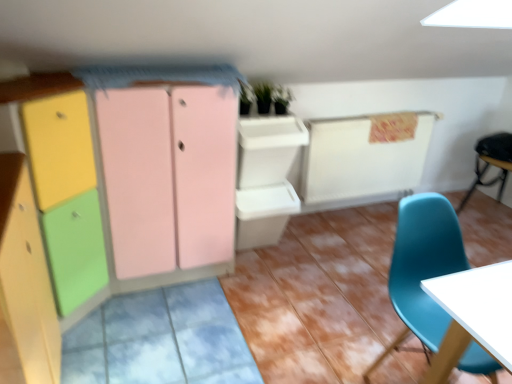
The width and height of the screenshot is (512, 384). In order to click on free spot to the right of matte plastic dresser at center in this screenshot , I will do `click(327, 287)`.